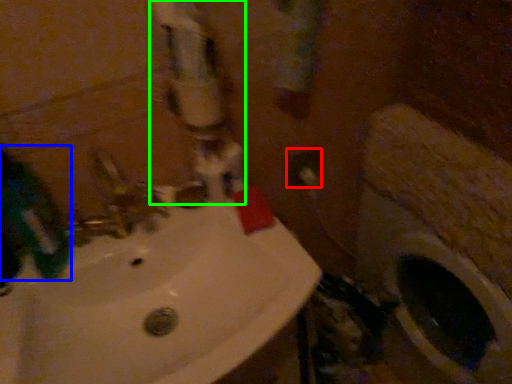
Question: Estimate the real-world distances between objects in this image. Which object is closer to electric outlet (highlighted by a red box), mouthwash (highlighted by a blue box) or water pipe (highlighted by a green box)?

Choices:
 (A) mouthwash
 (B) water pipe

Answer: (B)